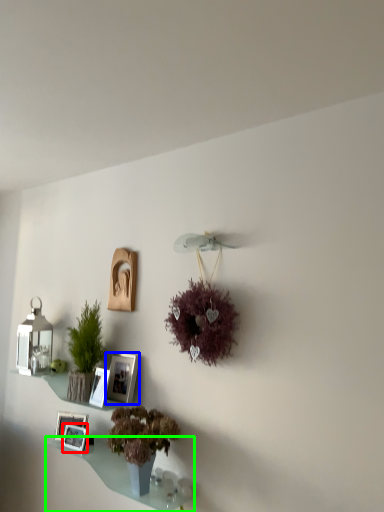
Question: Considering the real-world distances, which object is farthest from picture frame (highlighted by a red box)? picture frame (highlighted by a blue box) or window sill (highlighted by a green box)?

Choices:
 (A) picture frame
 (B) window sill

Answer: (A)